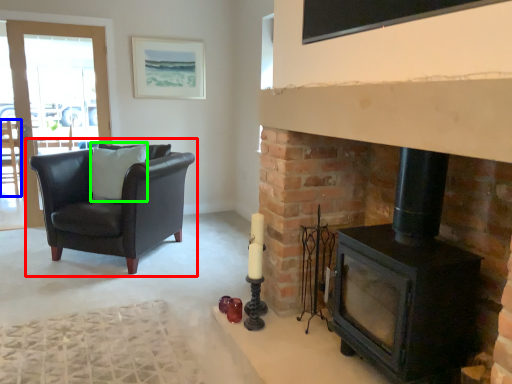
Question: Estimate the real-world distances between objects in this image. Which object is closer to chair (highlighted by a red box), chair (highlighted by a blue box) or pillow (highlighted by a green box)?

Choices:
 (A) chair
 (B) pillow

Answer: (B)